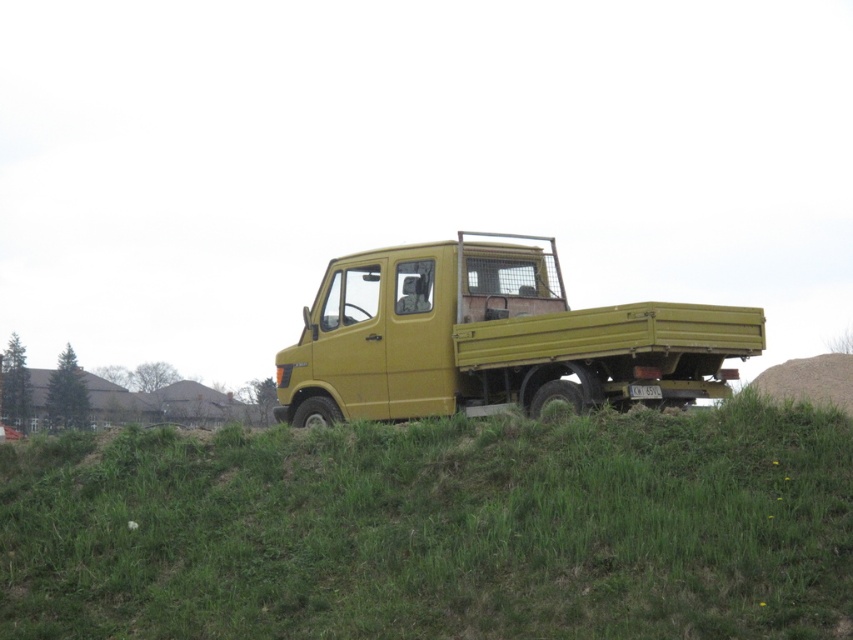
Question: Does green grassy hillside at center appear under matte yellow truck at center?

Choices:
 (A) yes
 (B) no

Answer: (A)

Question: Does green grassy hillside at center appear over matte yellow truck at center?

Choices:
 (A) no
 (B) yes

Answer: (A)

Question: Does green grassy hillside at center appear on the right side of matte yellow truck at center?

Choices:
 (A) yes
 (B) no

Answer: (B)

Question: Which point is closer to the camera?

Choices:
 (A) (361, 458)
 (B) (585, 403)

Answer: (A)